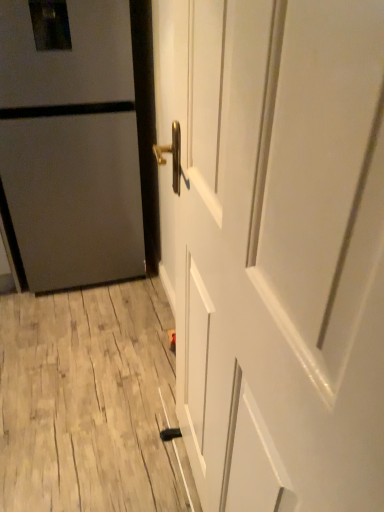
Question: From a real-world perspective, is white glossy door at center, which ranks as the first door in front-to-back order, positioned over matte gray door at left, marked as the 1th door in a back-to-front arrangement, based on gravity?

Choices:
 (A) no
 (B) yes

Answer: (B)

Question: Considering the relative sizes of white glossy door at center, the 2th door viewed from the back, and matte gray door at left, arranged as the 2th door when viewed from the right, in the image provided, is white glossy door at center, the 2th door viewed from the back, shorter than matte gray door at left, arranged as the 2th door when viewed from the right,?

Choices:
 (A) yes
 (B) no

Answer: (B)

Question: Does white glossy door at center, the 2th door viewed from the back, have a greater height compared to matte gray door at left, the 1th door when ordered from left to right?

Choices:
 (A) no
 (B) yes

Answer: (B)

Question: Is white glossy door at center, the 2th door viewed from the back, looking in the opposite direction of matte gray door at left, which appears as the second door when viewed from the front?

Choices:
 (A) yes
 (B) no

Answer: (B)

Question: Could you tell me if white glossy door at center, the 2th door viewed from the back, is facing matte gray door at left, the 1th door when ordered from left to right?

Choices:
 (A) yes
 (B) no

Answer: (B)

Question: Can you confirm if white glossy door at center, which ranks as the first door in front-to-back order, is wider than matte gray door at left, marked as the 1th door in a back-to-front arrangement?

Choices:
 (A) yes
 (B) no

Answer: (B)

Question: Are matte gray door at left, marked as the 1th door in a back-to-front arrangement, and white glossy door at center, marked as the first door in a right-to-left arrangement, located far from each other?

Choices:
 (A) no
 (B) yes

Answer: (B)

Question: Is matte gray door at left, marked as the 1th door in a back-to-front arrangement, taller than white glossy door at center, marked as the first door in a right-to-left arrangement?

Choices:
 (A) no
 (B) yes

Answer: (A)

Question: Is matte gray door at left, which appears as the second door when viewed from the front, bigger than white glossy door at center, the 2th door viewed from the back?

Choices:
 (A) yes
 (B) no

Answer: (A)

Question: Is the position of matte gray door at left, arranged as the 2th door when viewed from the right, less distant than that of white glossy door at center, marked as the first door in a right-to-left arrangement?

Choices:
 (A) no
 (B) yes

Answer: (A)

Question: From the image's perspective, is matte gray door at left, the 1th door when ordered from left to right, under white glossy door at center, which ranks as the first door in front-to-back order?

Choices:
 (A) no
 (B) yes

Answer: (A)

Question: Is matte gray door at left, arranged as the 2th door when viewed from the right, touching white glossy door at center, which ranks as the first door in front-to-back order?

Choices:
 (A) no
 (B) yes

Answer: (A)

Question: Considering the positions of white glossy door at center, the 2th door viewed from the back, and matte gray door at left, marked as the 1th door in a back-to-front arrangement, in the image, is white glossy door at center, the 2th door viewed from the back, taller or shorter than matte gray door at left, marked as the 1th door in a back-to-front arrangement,?

Choices:
 (A) tall
 (B) short

Answer: (A)